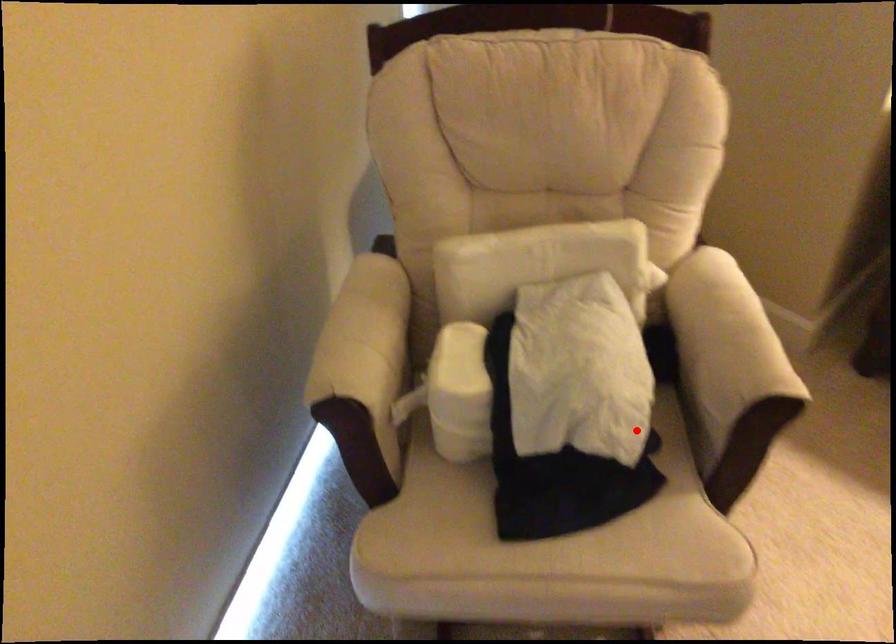
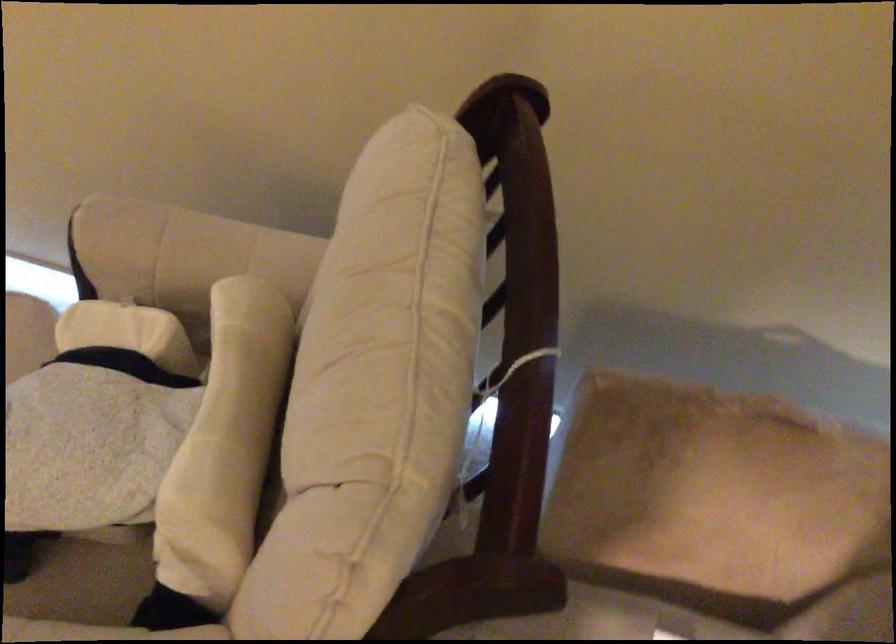
The point at the highlighted location is marked in the first image. Where is the corresponding point in the second image?

(82, 583)